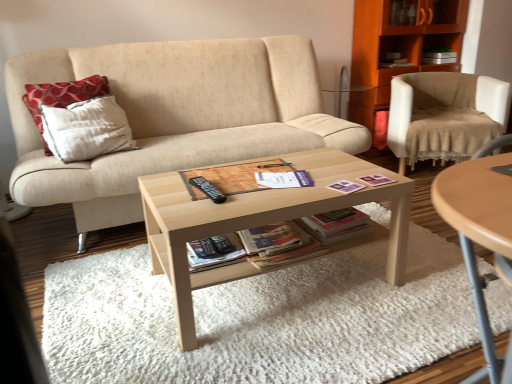
Question: Is beige fabric chair at right inside the boundaries of wooden cabinet at upper right, or outside?

Choices:
 (A) outside
 (B) inside

Answer: (A)

Question: From the image's perspective, is beige fabric chair at right positioned above or below wooden cabinet at upper right?

Choices:
 (A) below
 (B) above

Answer: (A)

Question: Estimate the real-world distances between objects in this image. Which object is closer to the black matte paperback book at center, the 1th paperback book in the left-to-right sequence?

Choices:
 (A) white paper at center
 (B) light wood coffee table at center
 (C) red dotted fabric pillow at left
 (D) wooden cabinet at upper right
 (E) light wood/texture coffee table at center

Answer: (E)

Question: Which is nearer to the matte paper paperback book at center, the second paperback book from the left?

Choices:
 (A) black matte paperback book at center, arranged as the second paperback book when viewed from the right
 (B) beige fabric couch at center
 (C) beige fabric chair at right
 (D) light wood coffee table at center
 (E) white paper at center

Answer: (A)